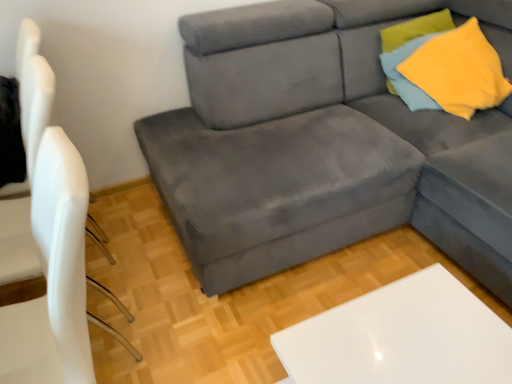
Question: Is point [20, 114] positioned closer to the camera than point [496, 352]?

Choices:
 (A) closer
 (B) farther

Answer: (B)

Question: Considering their positions, is white matte chair at left located in front of or behind white glossy table at lower right?

Choices:
 (A) behind
 (B) front

Answer: (B)

Question: Based on their relative distances, which object is nearer to the yellow soft fabric pillow at upper right?

Choices:
 (A) yellow soft fabric pillow at upper right
 (B) white glossy table at lower right
 (C) velvet gray couch at center
 (D) white matte chair at left

Answer: (A)

Question: Based on their relative distances, which object is nearer to the yellow soft fabric pillow at upper right?

Choices:
 (A) velvet gray couch at center
 (B) yellow soft fabric pillow at upper right
 (C) white matte chair at left
 (D) white glossy table at lower right

Answer: (B)